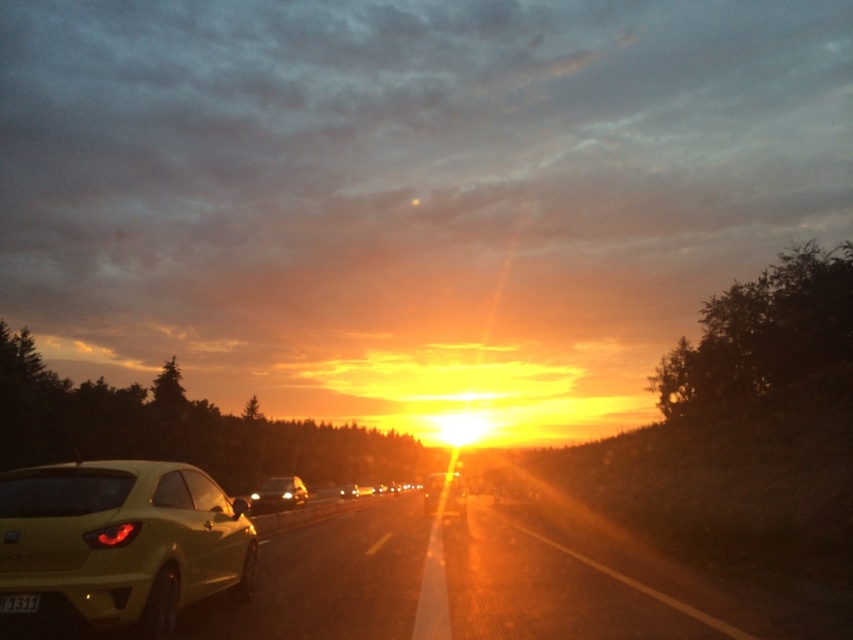
Question: Does matte yellow car at center appear on the right side of metallic gold car at center?

Choices:
 (A) no
 (B) yes

Answer: (A)

Question: Which object appears farthest from the camera in this image?

Choices:
 (A) matte yellow car at center
 (B) metallic yellow hatchback at lower left
 (C) matte black sedan at center
 (D) metallic gold car at center

Answer: (C)

Question: Which is farther from the metallic gold car at center?

Choices:
 (A) metallic yellow hatchback at lower left
 (B) matte yellow car at center

Answer: (A)

Question: Considering the relative positions of metallic yellow hatchback at lower left and metallic gold car at center in the image provided, where is metallic yellow hatchback at lower left located with respect to metallic gold car at center?

Choices:
 (A) right
 (B) left

Answer: (B)

Question: Which object is closer to the camera taking this photo?

Choices:
 (A) matte yellow car at center
 (B) metallic gold car at center

Answer: (B)

Question: Does metallic gold car at center appear on the right side of matte black sedan at center?

Choices:
 (A) yes
 (B) no

Answer: (A)